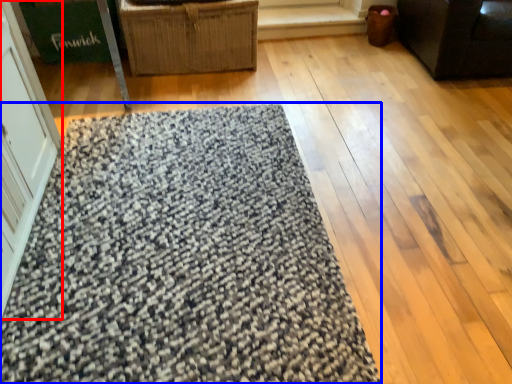
Question: Which of the following is the farthest to the observer, screen door (highlighted by a red box) or mat (highlighted by a blue box)?

Choices:
 (A) screen door
 (B) mat

Answer: (B)